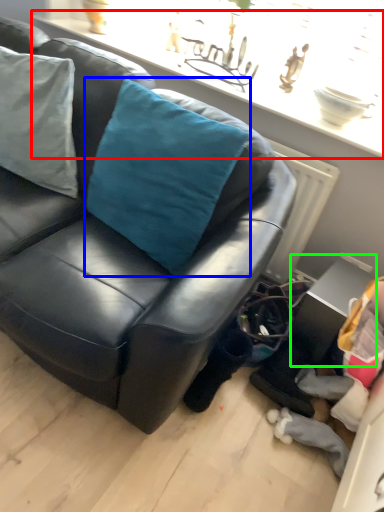
Question: Estimate the real-world distances between objects in this image. Which object is closer to window sill (highlighted by a red box), throw pillow (highlighted by a blue box) or table (highlighted by a green box)?

Choices:
 (A) throw pillow
 (B) table

Answer: (A)